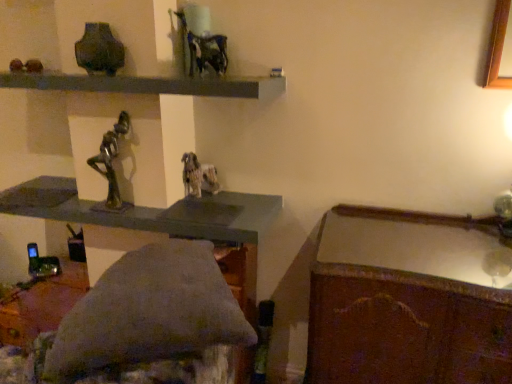
Question: Considering the positions of wooden polished desk at lower right and matte dark green vase at upper left in the image, is wooden polished desk at lower right wider or thinner than matte dark green vase at upper left?

Choices:
 (A) thin
 (B) wide

Answer: (B)

Question: Is wooden polished desk at lower right in front of or behind matte dark green vase at upper left in the image?

Choices:
 (A) behind
 (B) front

Answer: (B)

Question: Which is nearer to the wooden polished desk at lower right?

Choices:
 (A) smooth gray shelf at upper center
 (B) matte dark green vase at upper left
 (C) bronze statue at center

Answer: (A)

Question: Which is farther from the bronze statue at center?

Choices:
 (A) wooden polished desk at lower right
 (B) smooth gray shelf at upper center
 (C) matte dark green vase at upper left

Answer: (A)